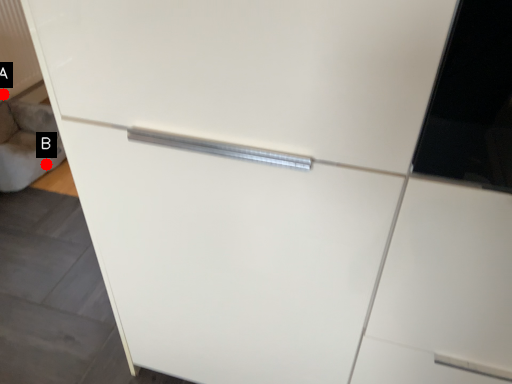
Question: Two points are circled on the image, labeled by A and B beside each circle. Which of the following is the farthest from the observer?

Choices:
 (A) A is further
 (B) B is further

Answer: (A)